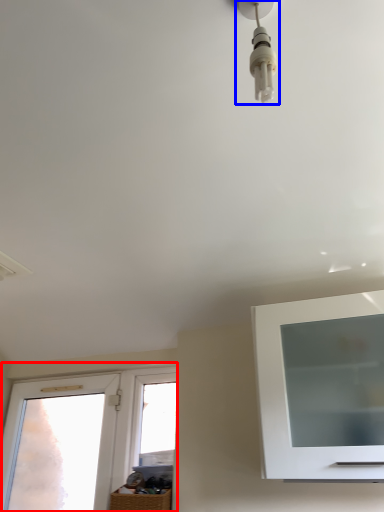
Question: Which object appears closest to the camera in this image, window (highlighted by a red box) or light fixture (highlighted by a blue box)?

Choices:
 (A) window
 (B) light fixture

Answer: (B)